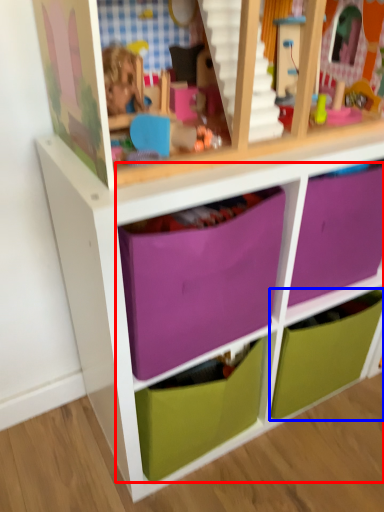
Question: Which object appears closest to the camera in this image, drawer (highlighted by a red box) or drawer (highlighted by a blue box)?

Choices:
 (A) drawer
 (B) drawer

Answer: (A)